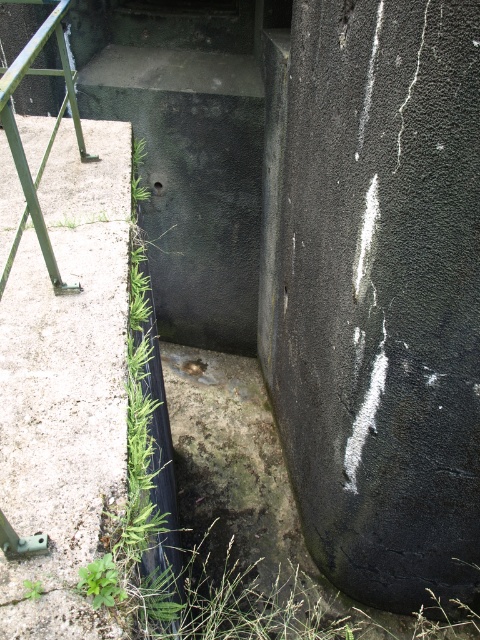
Is green metal rail at left closer to the viewer compared to green leafy weed at lower left?

That is False.

Can you confirm if green metal rail at left is taller than green leafy weed at lower left?

Yes, green metal rail at left is taller than green leafy weed at lower left.

At what (x,y) coordinates should I click in order to perform the action: click on green metal rail at left. Please return your answer as a coordinate pair (x, y). Looking at the image, I should click on (48, 140).

Is gray concrete at left to the left of green leafy weed at lower left from the viewer's perspective?

Yes, gray concrete at left is to the left of green leafy weed at lower left.

Locate an element on the screen. gray concrete at left is located at coordinates click(66, 385).

Is gray concrete at left bigger than green metal rail at left?

Correct, gray concrete at left is larger in size than green metal rail at left.

Can you confirm if gray concrete at left is positioned below green metal rail at left?

Indeed, gray concrete at left is positioned under green metal rail at left.

Does point (96, 632) come behind point (19, 164)?

No, (96, 632) is in front of (19, 164).

Locate an element on the screen. The width and height of the screenshot is (480, 640). gray concrete at left is located at coordinates (66, 385).